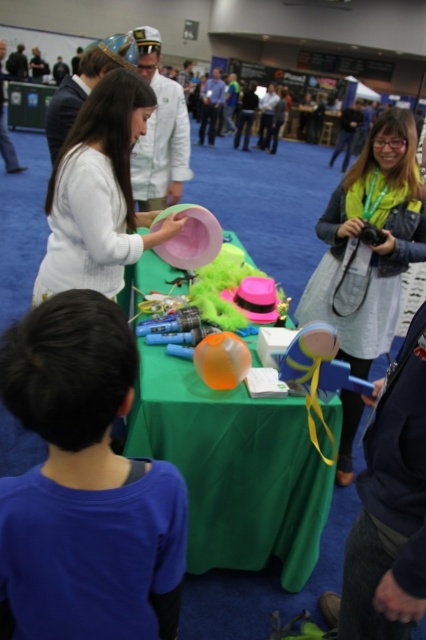
Can you confirm if blue fabric shirt at lower left is positioned above matte white sweater at center?

No, blue fabric shirt at lower left is not above matte white sweater at center.

Between point (45, 490) and point (109, 161), which one is positioned in front?

Point (45, 490)

Identify the location of blue fabric shirt at lower left. (85, 484).

Does matte white sweater at center have a greater height compared to blue rubber toy at center?

Correct, matte white sweater at center is much taller as blue rubber toy at center.

The image size is (426, 640). What do you see at coordinates (98, 193) in the screenshot? I see `matte white sweater at center` at bounding box center [98, 193].

Who is more distant from viewer, (58, 173) or (325, 362)?

The point (58, 173) is more distant.

I want to click on matte white sweater at center, so click(x=98, y=193).

Between matte green dress at right and blue rubber toy at center, which one appears on the right side from the viewer's perspective?

matte green dress at right is more to the right.

Looking at this image, does matte green dress at right have a smaller size compared to blue rubber toy at center?

Incorrect, matte green dress at right is not smaller in size than blue rubber toy at center.

At what (x,y) coordinates should I click in order to perform the action: click on matte green dress at right. Please return your answer as a coordinate pair (x, y). Looking at the image, I should click on (368, 243).

Find the location of a particular element. Image resolution: width=426 pixels, height=640 pixels. matte green dress at right is located at coordinates (368, 243).